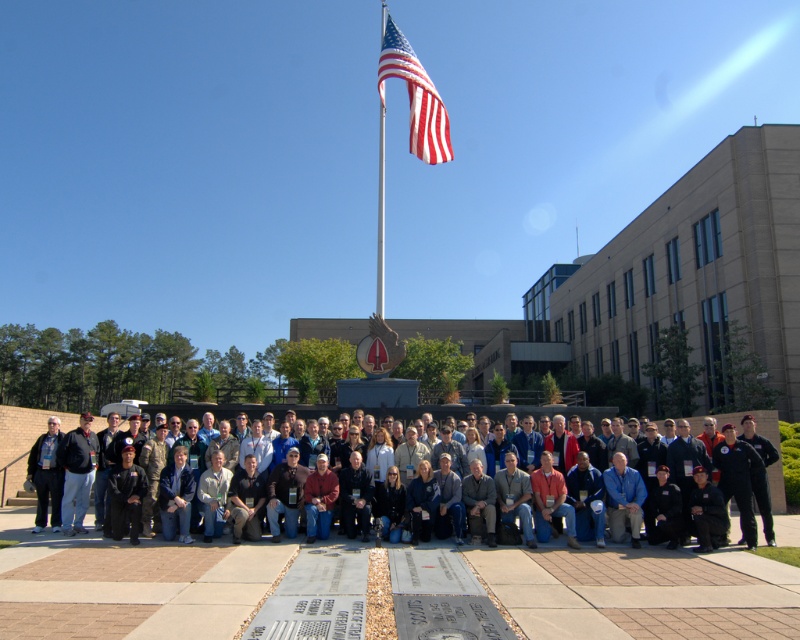
Can you confirm if dark gray jacket at lower left is positioned to the right of polished metal flag pole at upper center?

Yes, dark gray jacket at lower left is to the right of polished metal flag pole at upper center.

Does dark gray jacket at lower left come behind polished metal flag pole at upper center?

No, dark gray jacket at lower left is closer to the viewer.

Describe the element at coordinates (46, 476) in the screenshot. Image resolution: width=800 pixels, height=640 pixels. I see `dark gray jacket at lower left` at that location.

Identify the location of dark gray jacket at lower left. The height and width of the screenshot is (640, 800). (46, 476).

Between red-white striped fabric flag at upper center and dark gray jacket at lower left, which one appears on the left side from the viewer's perspective?

dark gray jacket at lower left

Consider the image. Does red-white striped fabric flag at upper center appear under dark gray jacket at lower left?

No, red-white striped fabric flag at upper center is not below dark gray jacket at lower left.

Is point (420, 138) positioned in front of point (44, 452)?

No, (420, 138) is further to viewer.

This screenshot has width=800, height=640. I want to click on red-white striped fabric flag at upper center, so click(416, 97).

Can you confirm if red-white striped fabric flag at upper center is bigger than polished metal flag pole at upper center?

No, red-white striped fabric flag at upper center is not bigger than polished metal flag pole at upper center.

Does red-white striped fabric flag at upper center have a greater height compared to polished metal flag pole at upper center?

No, red-white striped fabric flag at upper center is not taller than polished metal flag pole at upper center.

Does point (432, 115) come closer to viewer compared to point (384, 134)?

Yes, point (432, 115) is in front of point (384, 134).

This screenshot has width=800, height=640. What are the coordinates of `red-white striped fabric flag at upper center` in the screenshot? It's located at (416, 97).